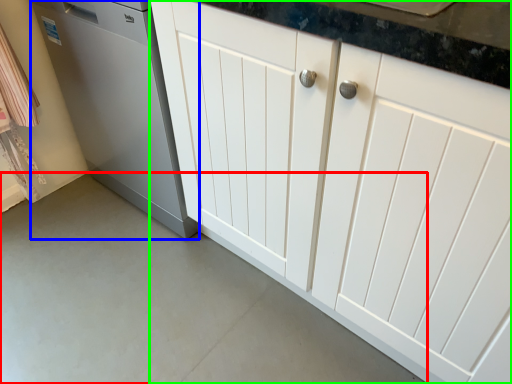
Question: Which is nearer to the concrete (highlighted by a red box)? home appliance (highlighted by a blue box) or cabinetry (highlighted by a green box).

Choices:
 (A) home appliance
 (B) cabinetry

Answer: (A)